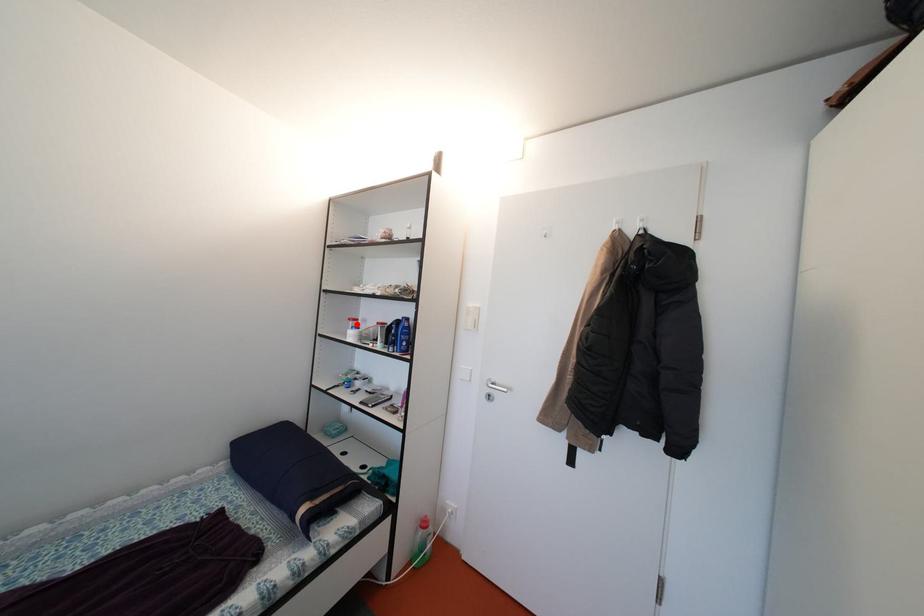
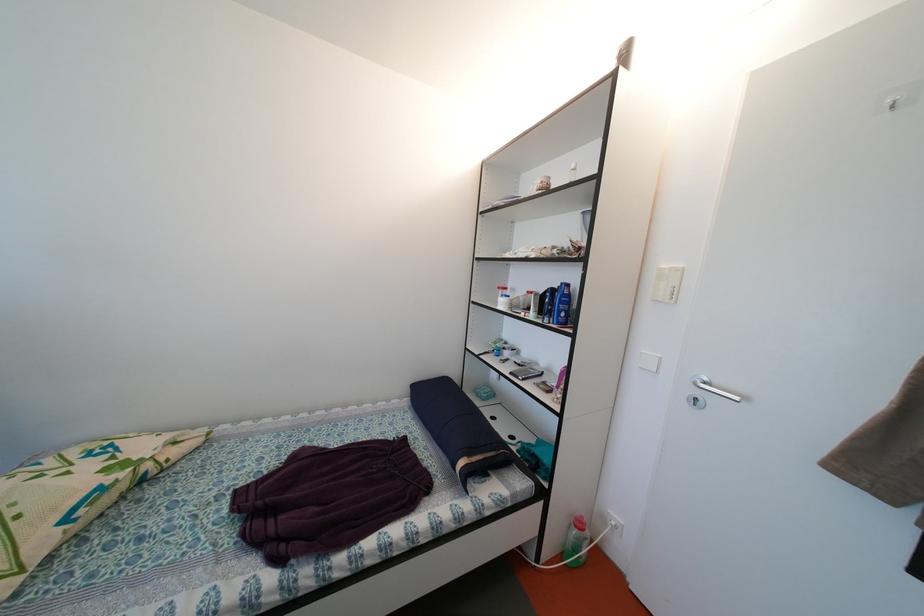
Locate, in the second image, the point that corresponds to the highlighted location in the first image.

(505, 293)